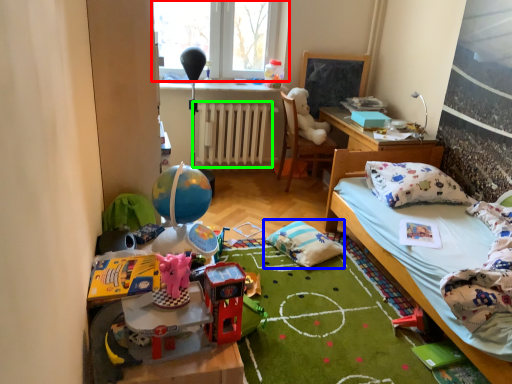
Question: Estimate the real-world distances between objects in this image. Which object is farther from window (highlighted by a red box), pillow (highlighted by a blue box) or radiator (highlighted by a green box)?

Choices:
 (A) pillow
 (B) radiator

Answer: (A)